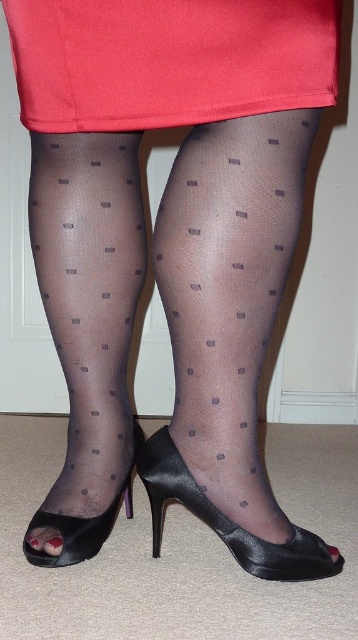
You are a fashion designer observing the image. You need to place a new accessory between the sheer polka dot tights at center and the sheer black tights at lower left. Which side should you place it on to maintain symmetry?

The sheer polka dot tights at center is positioned on the right side of the sheer black tights at lower left. To maintain symmetry, the accessory should be placed on the left side of the sheer black tights at lower left, balancing it with the existing placement of the sheer polka dot tights at center.

Where is the sheer polka dot tights at center located in the image?

The sheer polka dot tights at center is located at point [229,333] in the image.

You are a fashion designer analyzing the image. The sheer polka dot tights at center is represented by point (229, 333). Can you determine the coordinates of the point where the sheer polka dot tights at center meet the black high heels?

The sheer polka dot tights at center is represented by point (229, 333). However, the exact coordinates where it meets the black high heels cannot be determined from the provided information.